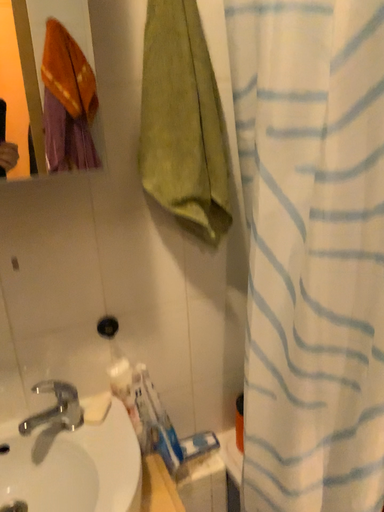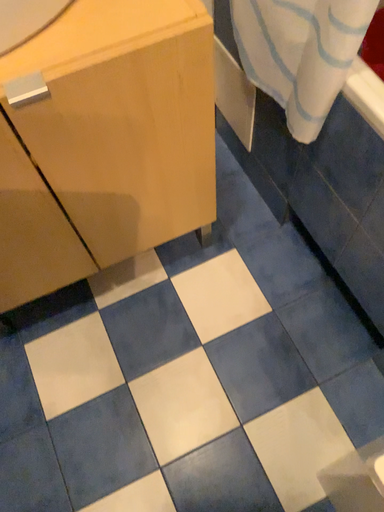
Question: How did the camera likely rotate when shooting the video?

Choices:
 (A) rotated downward
 (B) rotated upward

Answer: (A)